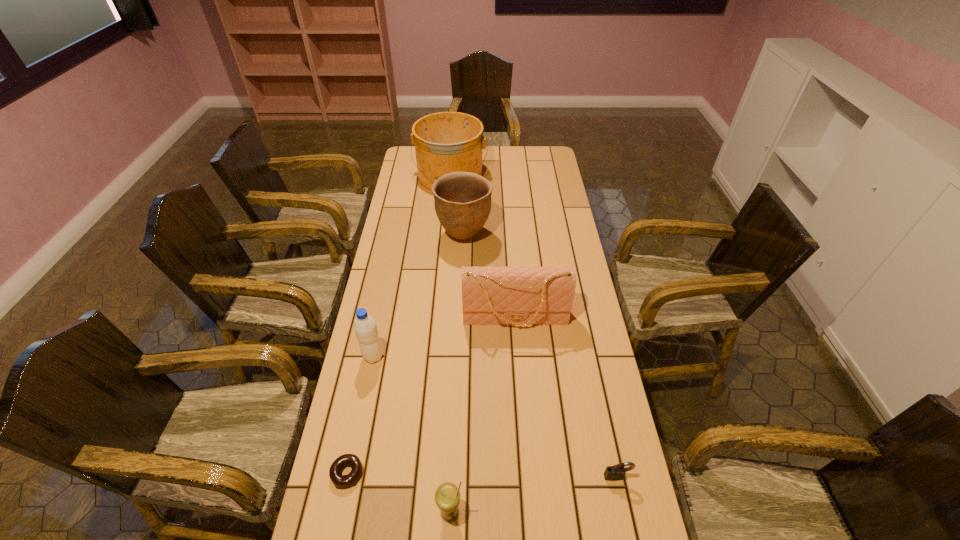
At what (x,y) coordinates should I click in order to perform the action: click on free space located on the right of the sixth nearest object. Please return your answer as a coordinate pair (x, y). The width and height of the screenshot is (960, 540). Looking at the image, I should click on (512, 235).

Image resolution: width=960 pixels, height=540 pixels. Identify the location of free region located 0.350m on the front-facing side of the handbag. (524, 436).

Identify the location of free space located on the right of the water bottle. (499, 356).

Locate an element on the screen. This screenshot has height=540, width=960. blank space located on the right of the nearest object is located at coordinates (489, 512).

You are a GUI agent. You are given a task and a screenshot of the screen. Output one action in this format:
    pyautogui.click(x=<x>, y=<y>)
    Task: Click on the free space located with the keyhole on the front of the rightmost object
    The height and width of the screenshot is (540, 960).
    Given the screenshot: What is the action you would take?
    pyautogui.click(x=624, y=511)

Find the location of a particular element. free location located on the right of the shortest object is located at coordinates (410, 473).

This screenshot has width=960, height=540. Find the location of `object that is at the far edge`. object that is at the far edge is located at coordinates (445, 142).

Locate an element on the screen. The height and width of the screenshot is (540, 960). bucket that is at the left edge is located at coordinates point(445,142).

At what (x,y) coordinates should I click in order to perform the action: click on water bottle located at the left edge. Please return your answer as a coordinate pair (x, y). This screenshot has height=540, width=960. Looking at the image, I should click on (365, 327).

Locate an element on the screen. The image size is (960, 540). doughnut present at the left edge is located at coordinates (342, 481).